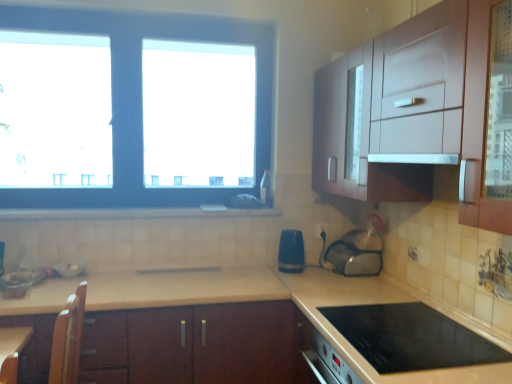
Question: Is black plastic electric outlet at center situated inside blue plastic toaster at center, which is the 2th appliance from right to left, or outside?

Choices:
 (A) inside
 (B) outside

Answer: (B)

Question: Considering the positions of black plastic electric outlet at center and blue plastic toaster at center, which is the 2th appliance from right to left, in the image, is black plastic electric outlet at center taller or shorter than blue plastic toaster at center, which is the 2th appliance from right to left,?

Choices:
 (A) tall
 (B) short

Answer: (B)

Question: Based on their relative distances, which object is farther from the black plastic electric outlet at center?

Choices:
 (A) blue plastic toaster at center, which is the 2th appliance from right to left
 (B) transparent plastic bag at center, the third appliance from the left
 (C) blue matte window at upper left
 (D) white tile at lower center
 (E) brown wood cabinet at center

Answer: (C)

Question: Which is farther from the black plastic electric outlet at center?

Choices:
 (A) brown wood cabinet at center
 (B) blue plastic toaster at center, marked as the second appliance in a left-to-right arrangement
 (C) white tile at lower center
 (D) white glossy exhaust hood at upper right
 (E) blue matte window at upper left

Answer: (E)